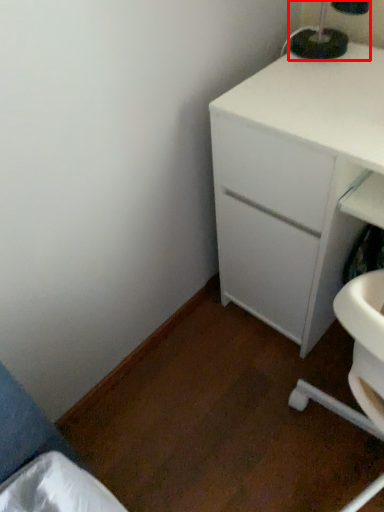
Question: Observing the image, what is the correct spatial positioning of bedside lamp (annotated by the red box) in reference to chest of drawers?

Choices:
 (A) right
 (B) left

Answer: (B)